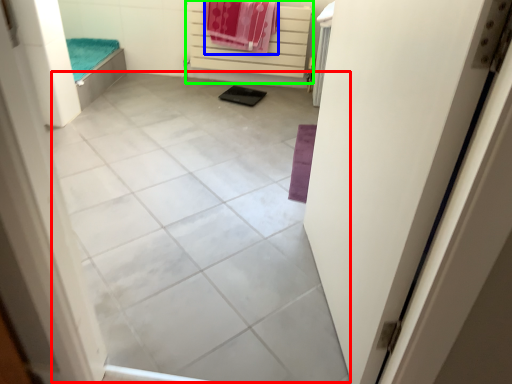
Question: Estimate the real-world distances between objects in this image. Which object is farther from tile (highlighted by a red box), beach towel (highlighted by a blue box) or balustrade (highlighted by a green box)?

Choices:
 (A) beach towel
 (B) balustrade

Answer: (B)